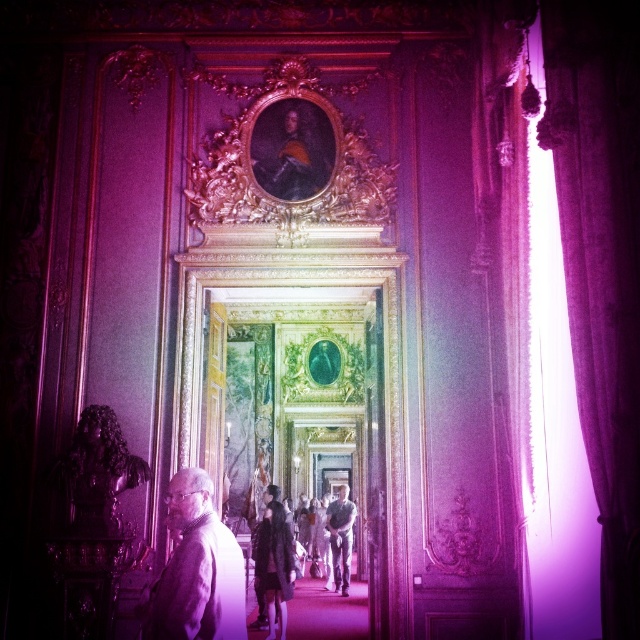
Question: Is silky purple curtain at right thinner than dark gray fabric jacket at center?

Choices:
 (A) yes
 (B) no

Answer: (A)

Question: Which point is closer to the camera?

Choices:
 (A) gray wool sweater at lower left
 (B) leather jacket at center

Answer: (A)

Question: Which is farther from the gray wool sweater at lower left?

Choices:
 (A) dark gray fabric jacket at center
 (B) silky purple curtain at right

Answer: (A)

Question: Which of the following is the farthest from the observer?

Choices:
 (A) silky purple curtain at right
 (B) dark gray fabric jacket at center
 (C) leather jacket at center
 (D) gray wool sweater at lower left

Answer: (B)

Question: Can you confirm if silky purple curtain at right is positioned to the right of dark gray fabric jacket at center?

Choices:
 (A) yes
 (B) no

Answer: (A)

Question: Is silky purple curtain at right bigger than gray wool sweater at lower left?

Choices:
 (A) yes
 (B) no

Answer: (A)